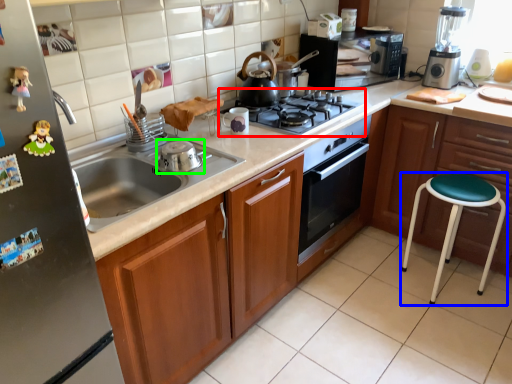
Question: Considering the real-world distances, which object is farthest from gas stove (highlighted by a red box)? stool (highlighted by a blue box) or appliance (highlighted by a green box)?

Choices:
 (A) stool
 (B) appliance

Answer: (A)